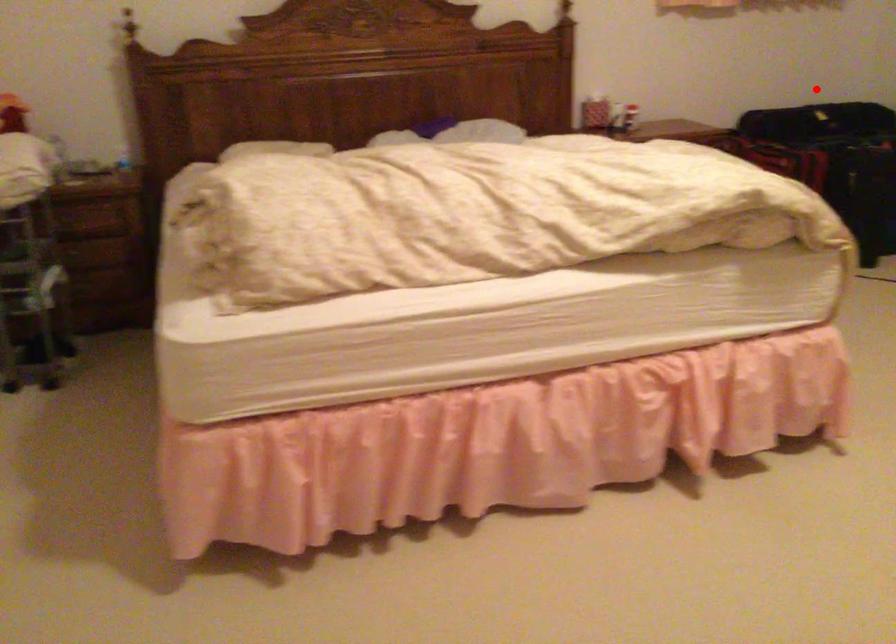
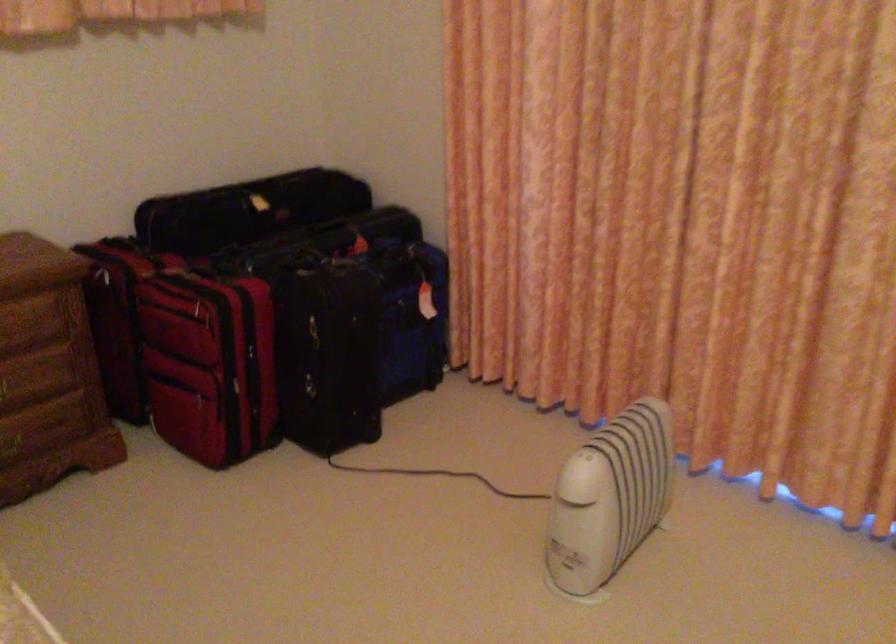
Find the pixel in the second image that matches the highlighted location in the first image.

(247, 210)